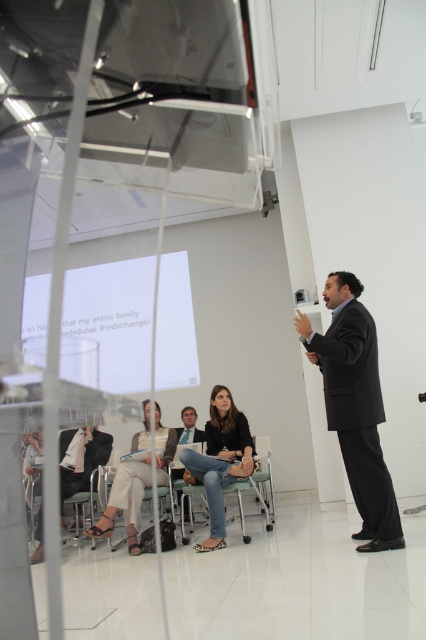
You are a photographer setting up for a TEDx event. You need to capture a photo of the light beige fabric pants at lower left and the light brown leather suit at center. Since there is a glass partition, you want to ensure both subjects are visible. Which subject is positioned to the left of the other?

The light beige fabric pants at lower left is to the left of the light brown leather suit at center.

Based on the photo, you are an event organizer standing at the entrance of the room. You notice two attendees wearing light beige fabric pants at lower left and matte black suit at lower left. Which attendee is standing closer to the glass partition?

The light beige fabric pants at lower left is above matte black suit at lower left, meaning it is closer to the glass partition than the matte black suit at lower left.

You are an event organizer who needs to seat two speakers wearing the black suit at center and the matte black jacket at center. Given their clothing widths, which speaker should you seat first to ensure they have enough space?

The black suit at center is wider than the matte black jacket at center. Therefore, you should seat the speaker in the black suit at center first to accommodate their larger width.